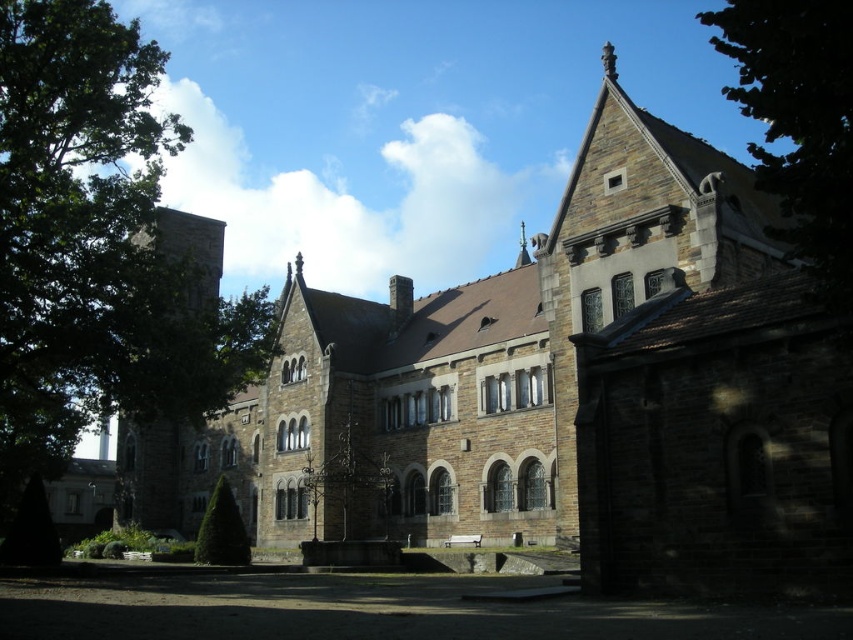
Does brown stone church at center have a lesser height compared to green leafy tree at upper right?

Yes.

Is brown stone church at center further to camera compared to green leafy tree at upper right?

Yes, brown stone church at center is behind green leafy tree at upper right.

Which is in front, point (427, 356) or point (772, 113)?

Positioned in front is point (772, 113).

The height and width of the screenshot is (640, 853). In order to click on brown stone church at center in this screenshot , I will do `click(560, 392)`.

Is brown stone church at center further to the viewer compared to green leafy tree at center?

No.

Can you confirm if brown stone church at center is positioned above green leafy tree at center?

Yes, brown stone church at center is above green leafy tree at center.

Does point (231, 424) come farther from viewer compared to point (218, 556)?

Yes, point (231, 424) is behind point (218, 556).

This screenshot has width=853, height=640. Identify the location of brown stone church at center. (560, 392).

Describe the element at coordinates (560, 392) in the screenshot. I see `brown stone church at center` at that location.

Is brown stone church at center smaller than green leafy tree at left?

Yes, brown stone church at center is smaller than green leafy tree at left.

This screenshot has width=853, height=640. What are the coordinates of `brown stone church at center` in the screenshot? It's located at (560, 392).

Identify the location of brown stone church at center. Image resolution: width=853 pixels, height=640 pixels. (560, 392).